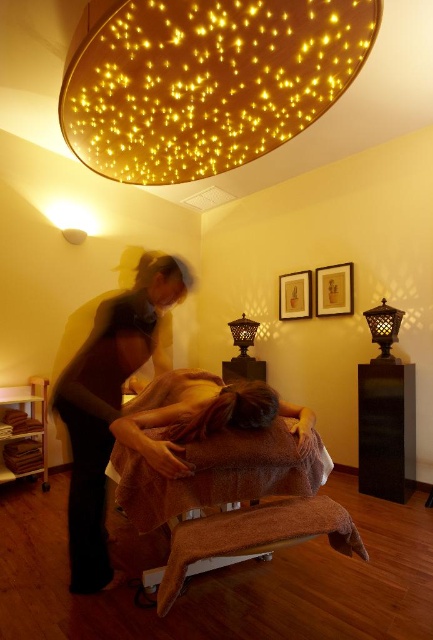
Question: Considering the real-world distances, which object is closest to the brown soft pillow at lower center?

Choices:
 (A) brown towel at center
 (B) matte black lantern at center
 (C) smooth beige towel at center
 (D) illuminated fiber optic ceiling at upper center

Answer: (A)

Question: Does smooth beige towel at center have a greater width compared to brown towel at center?

Choices:
 (A) no
 (B) yes

Answer: (A)

Question: Considering the relative positions of smooth beige towel at center and brown soft pillow at lower center in the image provided, where is smooth beige towel at center located with respect to brown soft pillow at lower center?

Choices:
 (A) above
 (B) below

Answer: (A)

Question: Which of the following is the closest to the observer?

Choices:
 (A) (246, 346)
 (B) (226, 452)
 (C) (96, 406)
 (D) (378, 316)

Answer: (B)

Question: Is illuminated fiber optic ceiling at upper center smaller than metallic gold lantern at upper right?

Choices:
 (A) no
 (B) yes

Answer: (A)

Question: Which object appears closest to the camera in this image?

Choices:
 (A) brown soft pillow at lower center
 (B) matte black lantern at center
 (C) brown towel at center

Answer: (C)